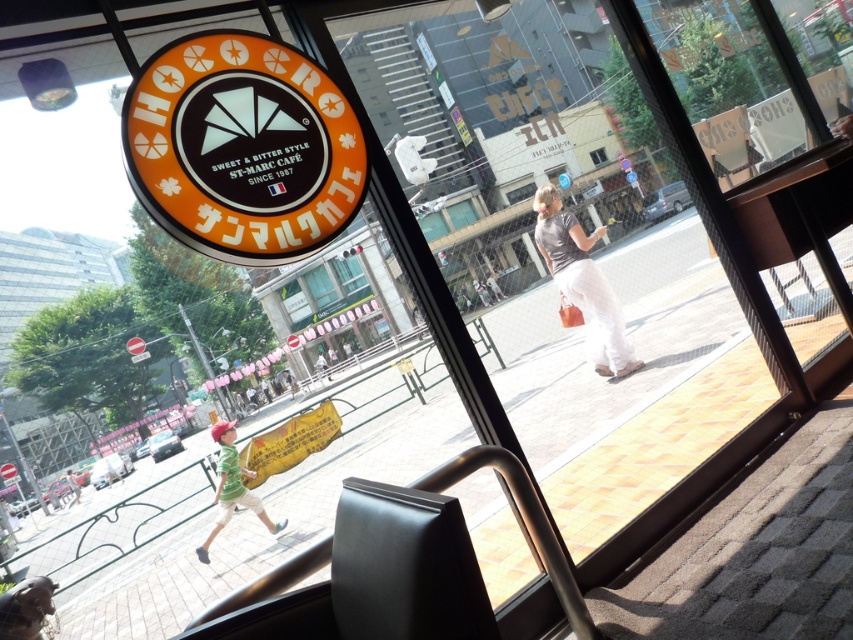
Based on the photo, which is more to the left, green striped shirt at lower left or transparent glass window at center?

Positioned to the left is green striped shirt at lower left.

Does green striped shirt at lower left have a lesser height compared to transparent glass window at center?

Incorrect, green striped shirt at lower left's height does not fall short of transparent glass window at center's.

The image size is (853, 640). What do you see at coordinates (231, 486) in the screenshot?
I see `green striped shirt at lower left` at bounding box center [231, 486].

Locate an element on the screen. The width and height of the screenshot is (853, 640). green striped shirt at lower left is located at coordinates (231, 486).

This screenshot has width=853, height=640. Describe the element at coordinates (242, 147) in the screenshot. I see `orange matte sign at upper left` at that location.

Does orange matte sign at upper left appear over green fabric shirt at lower left?

Result: Correct, orange matte sign at upper left is located above green fabric shirt at lower left.

Between point (160, 67) and point (76, 484), which one is positioned behind?

The point (76, 484) is behind.

Where is `orange matte sign at upper left`? orange matte sign at upper left is located at coordinates (242, 147).

Is point (558, 209) more distant than point (322, 364)?

That is False.

How distant is light brown cotton pants at center from green fabric umbrella at center?

They are 26.95 meters apart.

Is point (576, 248) closer to viewer compared to point (323, 372)?

Yes, it is in front of point (323, 372).

This screenshot has width=853, height=640. In order to click on light brown cotton pants at center in this screenshot , I will do `click(582, 282)`.